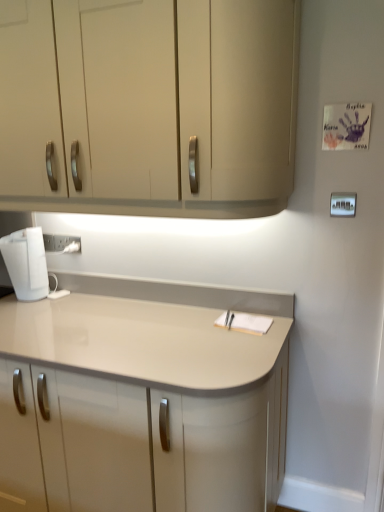
Question: From a real-world perspective, is matte beige countertop at center physically below white plastic electric outlet at lower left?

Choices:
 (A) yes
 (B) no

Answer: (A)

Question: Is matte beige countertop at center facing towards white plastic electric outlet at lower left?

Choices:
 (A) yes
 (B) no

Answer: (B)

Question: Can you confirm if matte beige countertop at center is shorter than white plastic electric outlet at lower left?

Choices:
 (A) no
 (B) yes

Answer: (A)

Question: Would you say matte beige countertop at center is a long distance from white plastic electric outlet at lower left?

Choices:
 (A) yes
 (B) no

Answer: (B)

Question: Is matte beige countertop at center completely or partially outside of white plastic electric outlet at lower left?

Choices:
 (A) yes
 (B) no

Answer: (A)

Question: Which is correct: matte beige countertop at center is inside white plastic electric outlet at lower left, or outside of it?

Choices:
 (A) inside
 (B) outside

Answer: (B)

Question: Considering the positions of matte beige countertop at center and white plastic electric outlet at lower left in the image, is matte beige countertop at center wider or thinner than white plastic electric outlet at lower left?

Choices:
 (A) thin
 (B) wide

Answer: (B)

Question: Based on their positions, is matte beige countertop at center located to the left or right of white plastic electric outlet at lower left?

Choices:
 (A) left
 (B) right

Answer: (B)

Question: Looking at the image, does matte beige countertop at center seem bigger or smaller compared to white plastic electric outlet at lower left?

Choices:
 (A) small
 (B) big

Answer: (B)

Question: From a real-world perspective, relative to white plastic electric outlet at lower left, is matte beige cabinet at upper center vertically above or below?

Choices:
 (A) above
 (B) below

Answer: (A)

Question: Is matte beige cabinet at upper center in front of or behind white plastic electric outlet at lower left in the image?

Choices:
 (A) behind
 (B) front

Answer: (B)

Question: From the image's perspective, is matte beige cabinet at upper center located above or below white plastic electric outlet at lower left?

Choices:
 (A) above
 (B) below

Answer: (A)

Question: In terms of width, does matte beige cabinet at upper center look wider or thinner when compared to white plastic electric outlet at lower left?

Choices:
 (A) wide
 (B) thin

Answer: (A)

Question: Considering the positions of matte beige cabinet at upper center and matte beige countertop at center in the image, is matte beige cabinet at upper center wider or thinner than matte beige countertop at center?

Choices:
 (A) thin
 (B) wide

Answer: (A)

Question: Relative to matte beige countertop at center, is matte beige cabinet at upper center in front or behind?

Choices:
 (A) behind
 (B) front

Answer: (B)